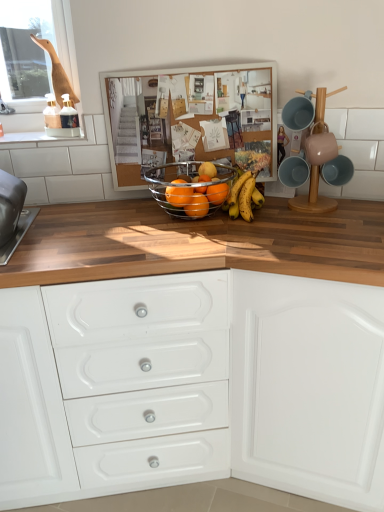
Find the location of a particular element. The width and height of the screenshot is (384, 512). vacant area in front of metallic orange fruit at center, the 3th orange from the right is located at coordinates (195, 239).